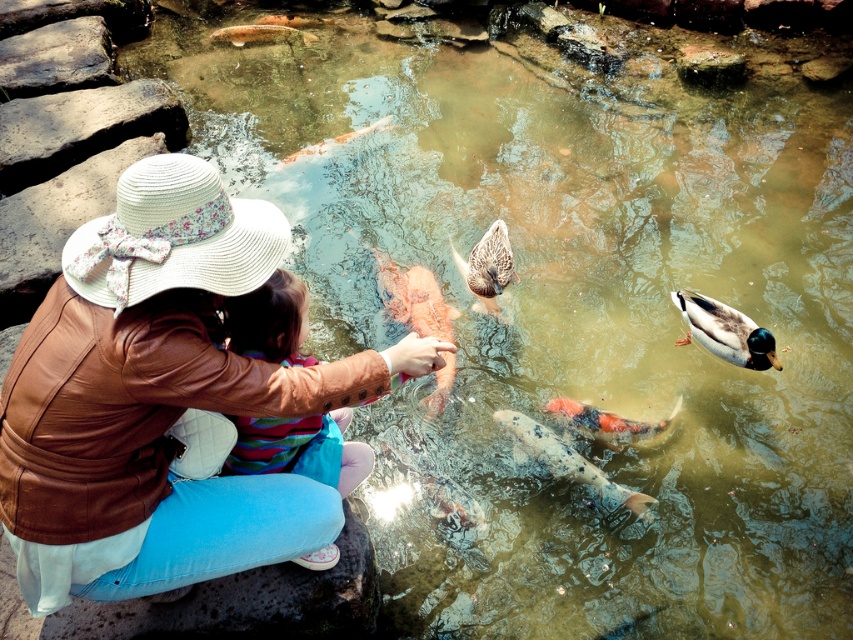
Consider the image. You are standing by the pond and see the speckled orange fish at center and the orange and white speckled fish at center. Which one is closer to the surface of the water?

The orange and white speckled fish at center is closer to the surface of the water because the speckled orange fish at center is below it.

You are a photographer trying to capture the scene of the brown feathered duck at center and the shiny metallic fish at upper center. Which of the two subjects is taller in the image?

The brown feathered duck at center is taller than the shiny metallic fish at upper center.

In the scene shown: You are a visitor at the pond and want to know which object is thinner between the brown feathered duck at center and the shiny metallic fish at upper center. Can you tell me?

The brown feathered duck at center is thinner than the shiny metallic fish at upper center.